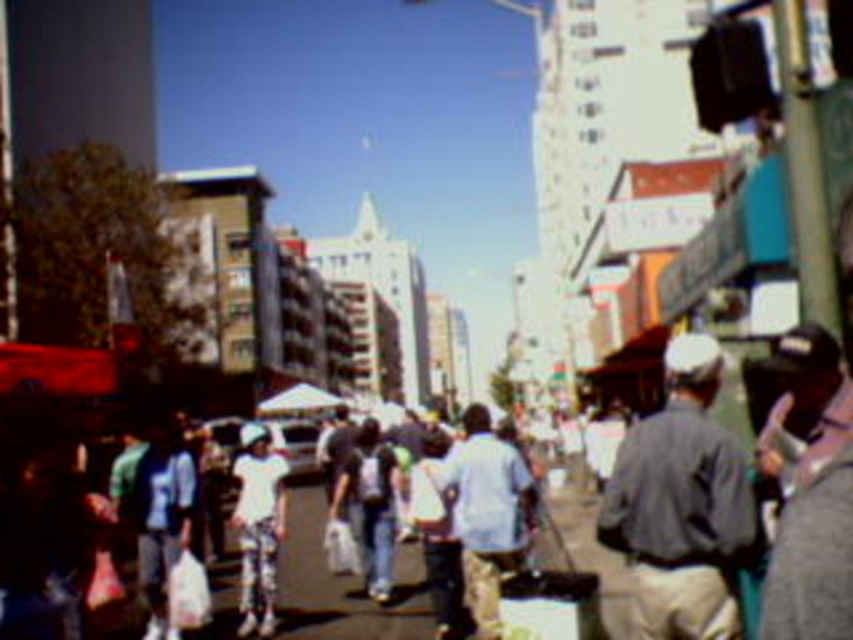
Who is lower down, gray fabric shirt at center or white matte pants at center?

white matte pants at center is lower down.

Between gray fabric shirt at center and white matte pants at center, which one has less height?

Standing shorter between the two is white matte pants at center.

Is point (694, 577) positioned in front of point (262, 534)?

Yes.

Where is `gray fabric shirt at center`? The height and width of the screenshot is (640, 853). gray fabric shirt at center is located at coordinates (682, 502).